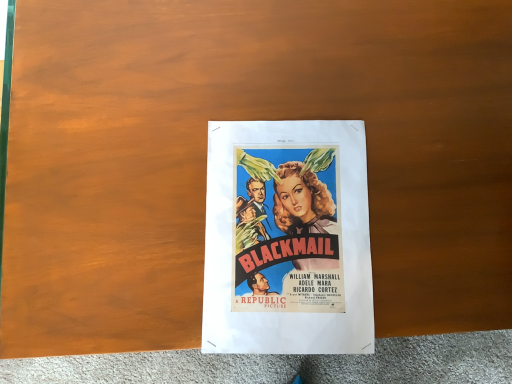
This screenshot has height=384, width=512. I want to click on free space above matte paper poster at center (from a real-world perspective), so click(x=281, y=240).